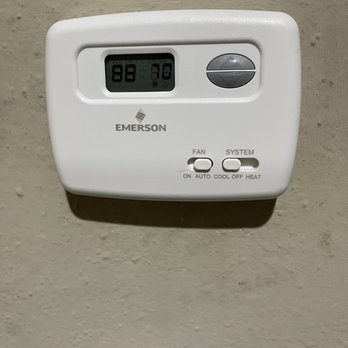
What are the coordinates of `control panel` in the screenshot? It's located at (187, 133).